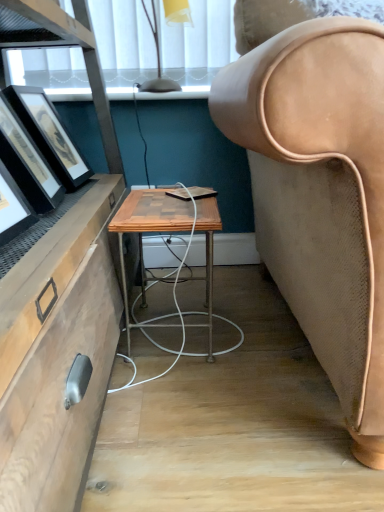
Find the location of `matte black picture frame at left`. matte black picture frame at left is located at coordinates (50, 135).

Image resolution: width=384 pixels, height=512 pixels. What do you see at coordinates (50, 135) in the screenshot?
I see `matte black picture frame at left` at bounding box center [50, 135].

What is the approximate height of translucent yellow glass lampshade at upper center?

It is 27.64 centimeters.

You are a GUI agent. You are given a task and a screenshot of the screen. Output one action in this format:
    pyautogui.click(x=<x>, y=<y>)
    Task: Click on the wooden/matte desk at center
    
    Given the screenshot: What is the action you would take?
    pyautogui.click(x=147, y=230)

From the image's perspective, which one is positioned higher, matte black picture frame at left or wooden/matte desk at center?

matte black picture frame at left is shown above in the image.

Does point (49, 104) appear closer or farther from the camera than point (172, 229)?

Point (49, 104) appears to be farther away from the viewer than point (172, 229).

Is matte black picture frame at left shorter than wooden/matte desk at center?

Correct, matte black picture frame at left is not as tall as wooden/matte desk at center.

How different are the orientations of matte black picture frame at left and wooden/matte desk at center in degrees?

87.7 degrees.

Considering the sizes of objects wooden/matte desk at center and matte black picture frame at left in the image provided, who is bigger, wooden/matte desk at center or matte black picture frame at left?

With larger size is wooden/matte desk at center.

Is wooden/matte desk at center in contact with matte black picture frame at left?

There is a gap between wooden/matte desk at center and matte black picture frame at left.

Is wooden/matte desk at center surrounding matte black picture frame at left?

No, matte black picture frame at left is not inside wooden/matte desk at center.

In the scene shown: From a real-world perspective, is wooden/matte desk at center located beneath translucent yellow glass lampshade at upper center?

Yes, from a real-world perspective, wooden/matte desk at center is below translucent yellow glass lampshade at upper center.

In the scene shown: Would you say translucent yellow glass lampshade at upper center is part of wooden/matte desk at center's contents?

Definitely not — translucent yellow glass lampshade at upper center is not inside wooden/matte desk at center.

Are wooden/matte desk at center and translucent yellow glass lampshade at upper center beside each other?

There is a gap between wooden/matte desk at center and translucent yellow glass lampshade at upper center.

Considering the sizes of objects wooden/matte desk at center and translucent yellow glass lampshade at upper center in the image provided, who is taller, wooden/matte desk at center or translucent yellow glass lampshade at upper center?

wooden/matte desk at center.

What's the angular difference between matte black picture frame at left and translucent yellow glass lampshade at upper center's facing directions?

Answer: They differ by 87.7 degrees in their facing directions.

From a real-world perspective, is matte black picture frame at left on top of translucent yellow glass lampshade at upper center?

No, from a real-world perspective, matte black picture frame at left is not above translucent yellow glass lampshade at upper center.

Can you confirm if matte black picture frame at left is positioned to the right of translucent yellow glass lampshade at upper center?

No.

From the image's perspective, which is below, matte black picture frame at left or translucent yellow glass lampshade at upper center?

From the image's view, matte black picture frame at left is below.

At what (x,y) coordinates should I click in order to perform the action: click on lamp located above the wooden/matte desk at center (from a real-world perspective). Please return your answer as a coordinate pair (x, y). Looking at the image, I should click on (157, 63).

Is translucent yellow glass lampshade at upper center to the left or to the right of wooden/matte desk at center in the image?

Clearly, translucent yellow glass lampshade at upper center is on the left of wooden/matte desk at center in the image.

Is translucent yellow glass lampshade at upper center bigger than wooden/matte desk at center?

No, translucent yellow glass lampshade at upper center is not bigger than wooden/matte desk at center.

How much distance is there between translucent yellow glass lampshade at upper center and matte black picture frame at left?

16.80 inches.

This screenshot has width=384, height=512. I want to click on picture frame located underneath the translucent yellow glass lampshade at upper center (from a real-world perspective), so click(50, 135).

From a real-world perspective, is translucent yellow glass lampshade at upper center under matte black picture frame at left?

Incorrect, from a real-world perspective, translucent yellow glass lampshade at upper center is higher than matte black picture frame at left.

Looking at this image, between translucent yellow glass lampshade at upper center and matte black picture frame at left, which one is positioned in front?

Result: matte black picture frame at left is closer to the camera.

I want to click on desk that is below the matte black picture frame at left (from the image's perspective), so point(147,230).

Identify the location of desk that appears in front of the matte black picture frame at left. (147, 230).

Which object lies nearer to the anchor point translucent yellow glass lampshade at upper center, wooden/matte desk at center or matte black picture frame at left?

matte black picture frame at left is positioned closer to the anchor translucent yellow glass lampshade at upper center.

Looking at the image, which one is located further to matte black picture frame at left, translucent yellow glass lampshade at upper center or wooden/matte desk at center?

The object further to matte black picture frame at left is translucent yellow glass lampshade at upper center.

Looking at the image, which one is located closer to wooden/matte desk at center, matte black picture frame at left or translucent yellow glass lampshade at upper center?

matte black picture frame at left is positioned closer to the anchor wooden/matte desk at center.

Based on the photo, when comparing their distances from wooden/matte desk at center, does translucent yellow glass lampshade at upper center or matte black picture frame at left seem further?

translucent yellow glass lampshade at upper center lies further to wooden/matte desk at center than the other object.

Estimate the real-world distances between objects in this image. Which object is further from translucent yellow glass lampshade at upper center, matte black picture frame at left or wooden/matte desk at center?

wooden/matte desk at center is further to translucent yellow glass lampshade at upper center.

Based on their spatial positions, is wooden/matte desk at center or translucent yellow glass lampshade at upper center further from matte black picture frame at left?

Among the two, translucent yellow glass lampshade at upper center is located further to matte black picture frame at left.

You are a GUI agent. You are given a task and a screenshot of the screen. Output one action in this format:
    pyautogui.click(x=<x>, y=<y>)
    Task: Click on the picture frame between translucent yellow glass lampshade at upper center and wooden/matte desk at center in the up-down direction
    
    Given the screenshot: What is the action you would take?
    pyautogui.click(x=50, y=135)